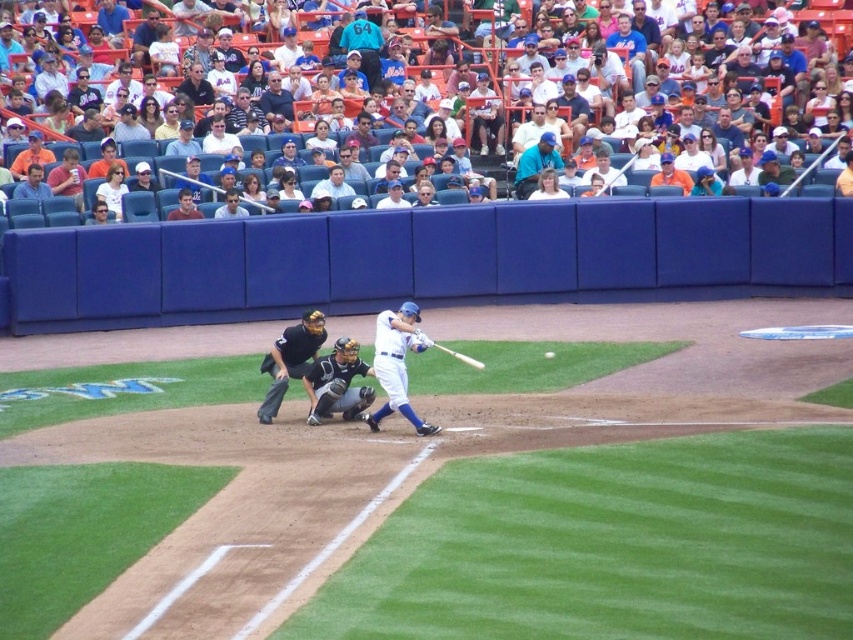
Question: Which point is farther from the camera taking this photo?

Choices:
 (A) (274, 77)
 (B) (490, 93)
 (C) (653, 186)
 (D) (308, 346)

Answer: (B)

Question: Observing the image, what is the correct spatial positioning of black leather umpire at center in reference to white matte baseball at center?

Choices:
 (A) above
 (B) below

Answer: (B)

Question: Is teal fabric jacket at upper center further to the viewer compared to dark blue uniform at center?

Choices:
 (A) yes
 (B) no

Answer: (A)

Question: Which of these objects is positioned farthest from the light brown leather jacket at upper center?

Choices:
 (A) dark gray leather catcher at center
 (B) black leather umpire at center

Answer: (A)

Question: Based on their relative distances, which object is farther from the white jersey at center?

Choices:
 (A) wooden baseball bat at center
 (B) black leather umpire at center
 (C) white baseball cap at center

Answer: (A)

Question: Can you confirm if white jersey at center is positioned to the right of wooden baseball bat at center?

Choices:
 (A) no
 (B) yes

Answer: (B)